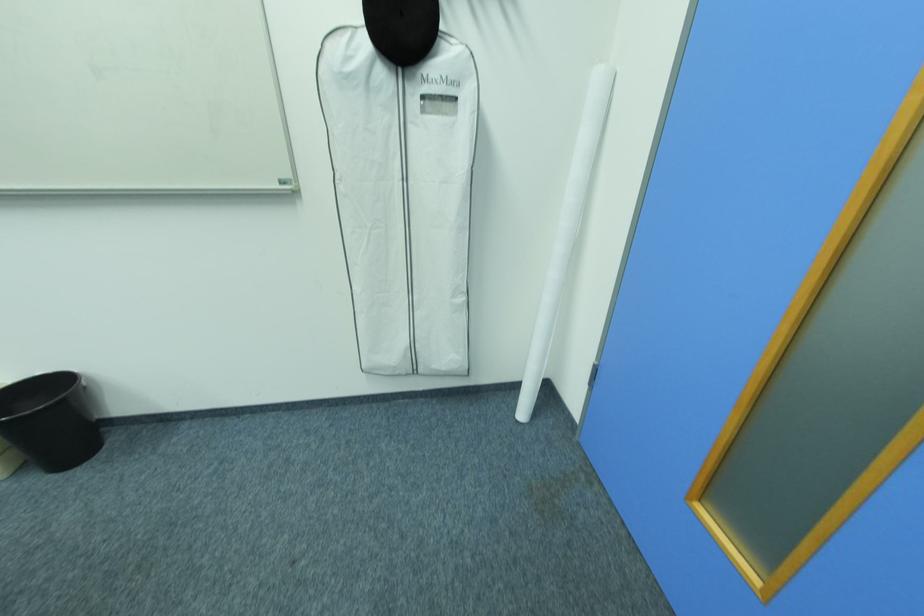
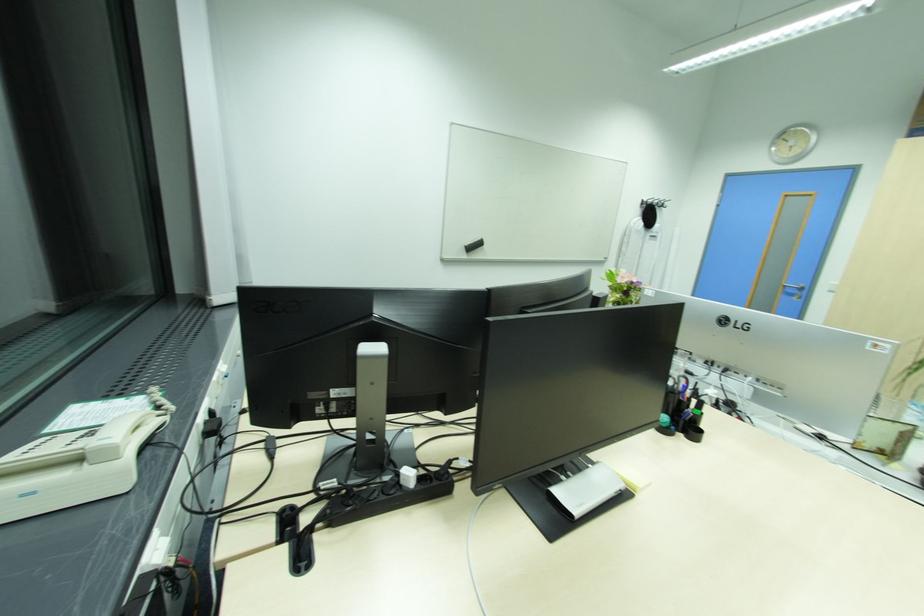
The images are taken continuously from a first-person perspective. In which direction are you moving?

The cameraman moved toward left, backward.